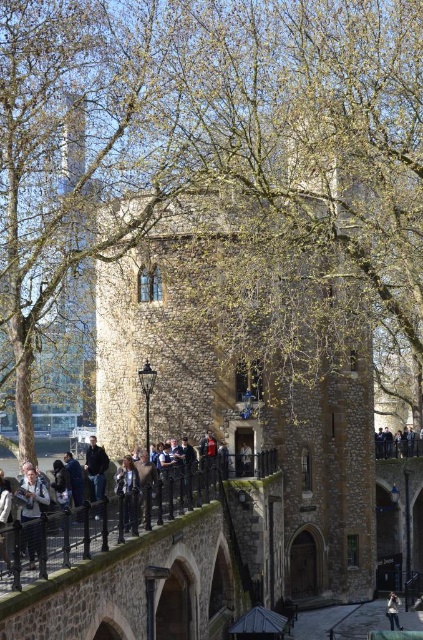
Does denim jacket at lower left have a lesser width compared to light brown leather jacket at center?

No.

Who is higher up, denim jacket at lower left or light brown leather jacket at center?

Positioned higher is denim jacket at lower left.

This screenshot has height=640, width=423. What are the coordinates of `denim jacket at lower left` in the screenshot? It's located at (32, 493).

You are a GUI agent. You are given a task and a screenshot of the screen. Output one action in this format:
    pyautogui.click(x=<x>, y=<y>)
    Task: Click on the denim jacket at lower left
    This screenshot has width=423, height=640.
    Given the screenshot: What is the action you would take?
    pyautogui.click(x=32, y=493)

Who is lower down, matte black people at center or light brown leather jacket at center?

light brown leather jacket at center is below.

Is matte black people at center to the right of light brown leather jacket at center from the viewer's perspective?

No, matte black people at center is not to the right of light brown leather jacket at center.

This screenshot has height=640, width=423. Describe the element at coordinates (99, 524) in the screenshot. I see `matte black people at center` at that location.

Identify the location of matte black people at center. This screenshot has height=640, width=423. (99, 524).

Is matte black people at center to the right of dark blue jeans at lower right from the viewer's perspective?

No, matte black people at center is not to the right of dark blue jeans at lower right.

Does matte black people at center have a lesser width compared to dark blue jeans at lower right?

Incorrect, matte black people at center's width is not less than dark blue jeans at lower right's.

At what (x,y) coordinates should I click in order to perform the action: click on matte black people at center. Please return your answer as a coordinate pair (x, y). The height and width of the screenshot is (640, 423). Looking at the image, I should click on (99, 524).

Locate an element on the screen. matte black people at center is located at coordinates (99, 524).